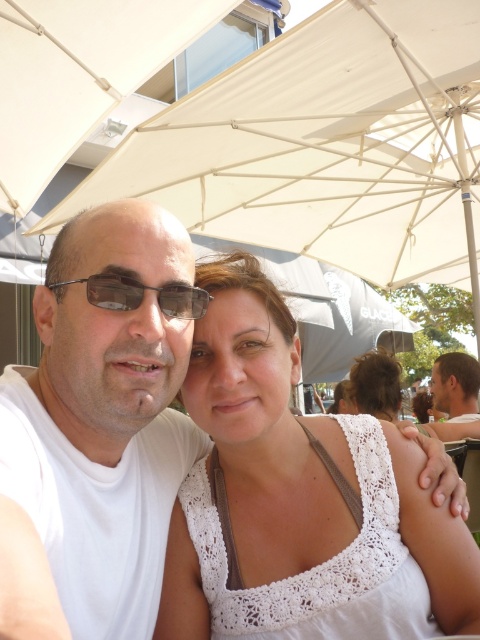
Question: Among these points, which one is farthest from the camera?

Choices:
 (A) (445, 364)
 (B) (177, 292)
 (C) (326, 112)

Answer: (A)

Question: Which point is farther to the camera?

Choices:
 (A) beige fabric umbrella at upper center
 (B) matte black sunglasses at center

Answer: (A)

Question: Which point appears farthest from the camera in this image?

Choices:
 (A) (190, 477)
 (B) (225, 118)
 (C) (141, 616)
 (D) (32, 65)

Answer: (B)

Question: Does matte black sunglasses at center have a smaller size compared to smooth brown hair at upper right?

Choices:
 (A) yes
 (B) no

Answer: (A)

Question: Does white lace tank top at center appear over beige fabric umbrella at upper center?

Choices:
 (A) no
 (B) yes

Answer: (A)

Question: Observing the image, what is the correct spatial positioning of white fabric umbrella at upper center in reference to beige fabric umbrella at upper center?

Choices:
 (A) left
 (B) right

Answer: (B)